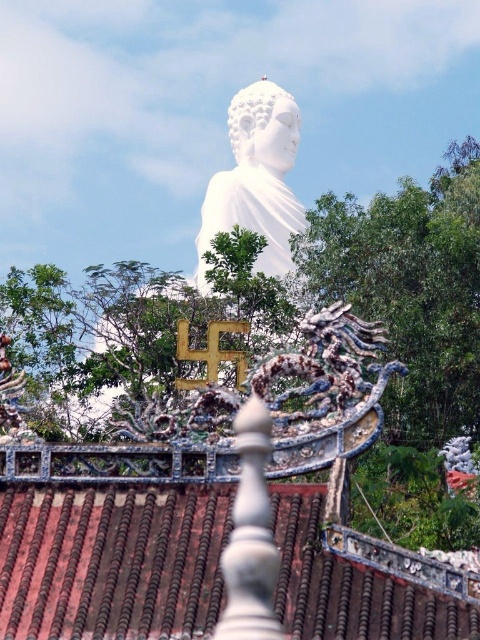
Which is more to the right, brown tile roof at center or white marble statue at center?

brown tile roof at center is more to the right.

Describe the element at coordinates (111, 561) in the screenshot. I see `brown tile roof at center` at that location.

Measure the distance between point (51,499) and camera.

Point (51,499) and camera are 79.44 meters apart from each other.

At what (x,y) coordinates should I click in order to perform the action: click on brown tile roof at center. Please return your answer as a coordinate pair (x, y). Looking at the image, I should click on (111, 561).